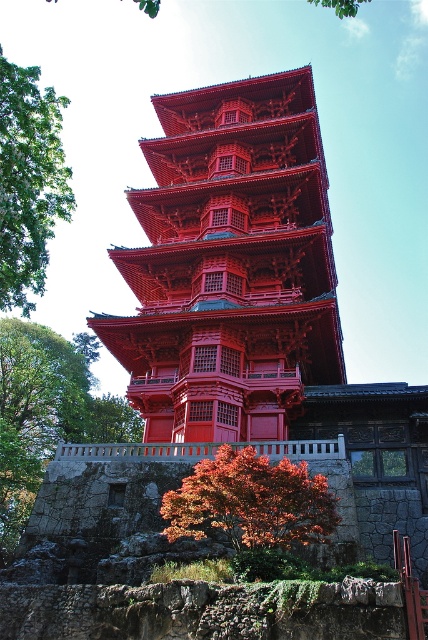
Question: Is green leafy tree at upper left to the left of shiny red maple tree at lower center from the viewer's perspective?

Choices:
 (A) no
 (B) yes

Answer: (B)

Question: Which object is the farthest from the shiny red maple tree at lower center?

Choices:
 (A) matte wood pagoda at center
 (B) green leafy tree at upper left

Answer: (B)

Question: Is matte wood pagoda at center closer to the viewer compared to shiny red maple tree at lower center?

Choices:
 (A) no
 (B) yes

Answer: (A)

Question: Estimate the real-world distances between objects in this image. Which object is closer to the shiny red maple tree at lower center?

Choices:
 (A) green leafy tree at upper left
 (B) matte wood pagoda at center

Answer: (B)

Question: Which point appears farthest from the camera in this image?

Choices:
 (A) (26, 86)
 (B) (204, 240)
 (C) (219, 480)

Answer: (B)

Question: Is matte wood pagoda at center to the left of shiny red maple tree at lower center from the viewer's perspective?

Choices:
 (A) no
 (B) yes

Answer: (B)